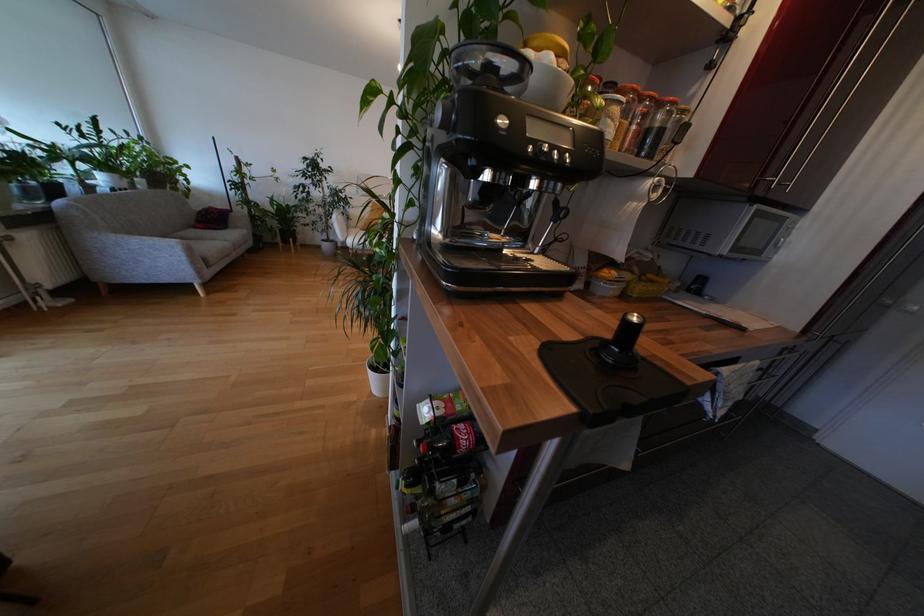
Where would you resting arm the grey sofa armrest? Please return your answer as a coordinate pair (x, y).

(148, 248)